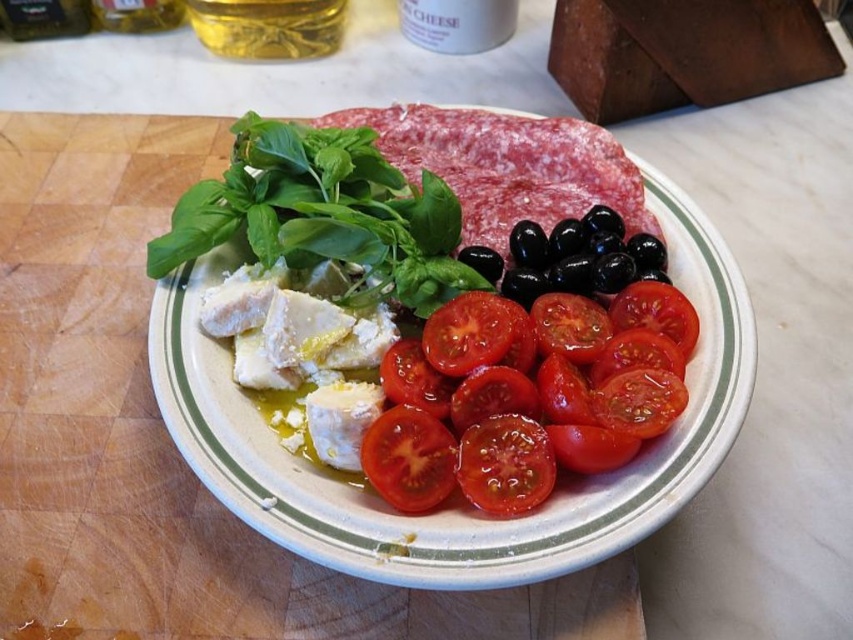
You are a food stylist arranging appetizers on a plate. You have two points marked on the plate at coordinates point (x=248, y=16) and point (x=538, y=442). Which point is closer to you when you are looking at the plate from above?

Point (x=248, y=16) is closer to you than point (x=538, y=442) because it is further to the viewer.

From the picture: Looking at the appetizer plate on the wooden cutting board, where is the golden liquid at top in relation to the bright red tomato at lower center?

The golden liquid at top is located to the left of the bright red tomato at lower center.